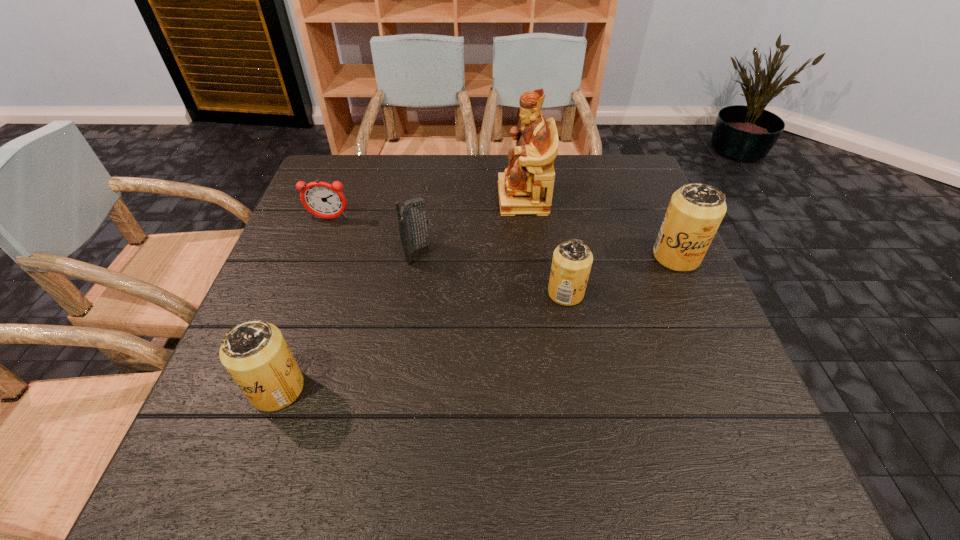
Select which object appears as the closest to the nearest beer can. Please provide its 2D coordinates. Your answer should be formatted as a tuple, i.e. [(x, y)], where the tuple contains the x and y coordinates of a point satisfying the conditions above.

[(413, 225)]

Identify which beer can is located as the nearest to the rightmost object. Please provide its 2D coordinates. Your answer should be formatted as a tuple, i.e. [(x, y)], where the tuple contains the x and y coordinates of a point satisfying the conditions above.

[(572, 260)]

The width and height of the screenshot is (960, 540). Find the location of `the closest beer can to the second beer can from right to left`. the closest beer can to the second beer can from right to left is located at coordinates (695, 211).

Identify the location of free spot that satisfies the following two spatial constraints: 1. on the front-facing side of the second tallest beer can; 2. on the right side of the alarm clock. (265, 389).

Image resolution: width=960 pixels, height=540 pixels. In order to click on vacant region that satisfies the following two spatial constraints: 1. on the front-facing side of the figurine; 2. on the left side of the rightmost object in this screenshot , I will do `click(530, 256)`.

What are the coordinates of `free location that satisfies the following two spatial constraints: 1. on the back side of the rightmost object; 2. on the front-facing side of the tallest object` in the screenshot? It's located at (650, 198).